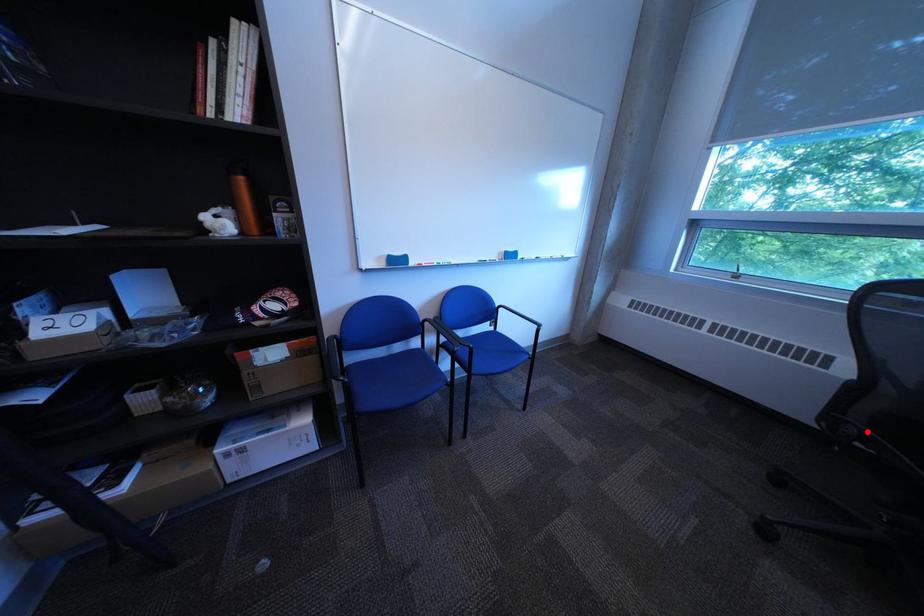
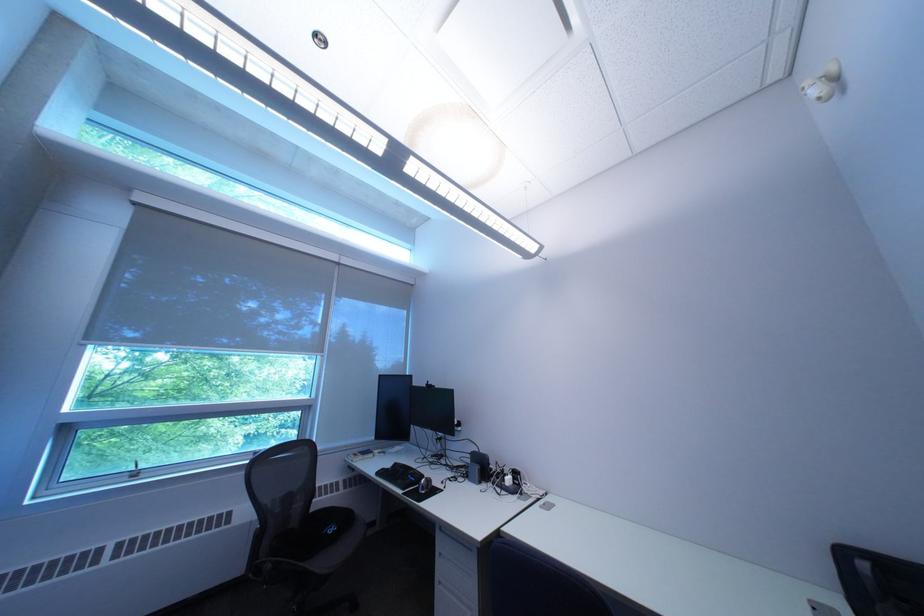
Find the pixel in the second image that matches the highlighted location in the first image.

(285, 568)